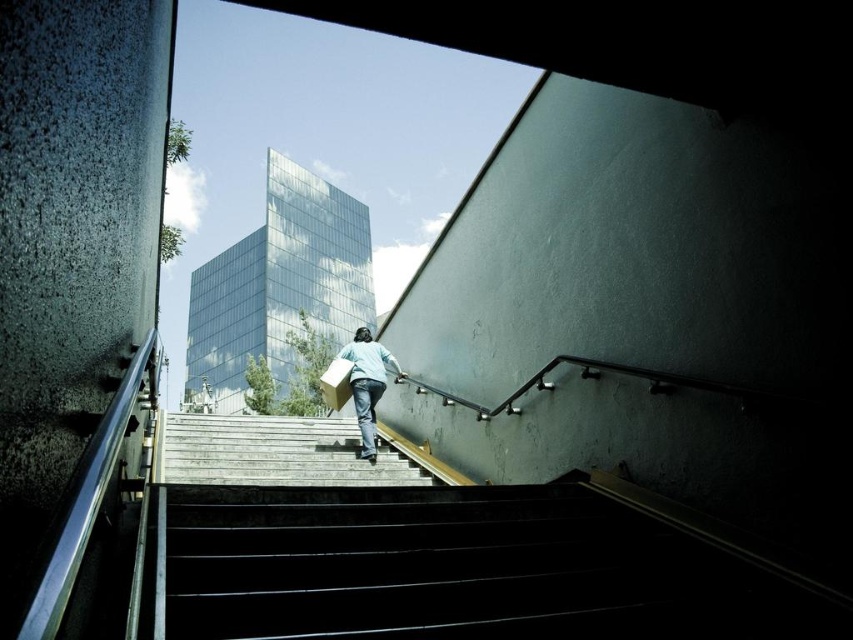
Consider the image. Can you confirm if wooden stairs at center is positioned to the right of light blue fabric at center?

Incorrect, wooden stairs at center is not on the right side of light blue fabric at center.

Between wooden stairs at center and light blue fabric at center, which one has less height?

With less height is wooden stairs at center.

Where is `wooden stairs at center`? wooden stairs at center is located at coordinates (273, 452).